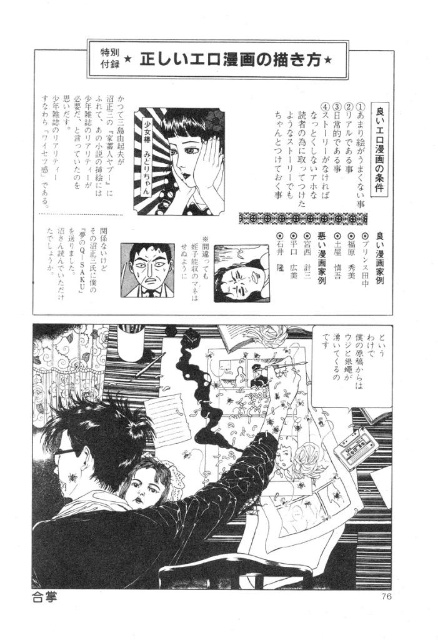
Question: Is smooth black hair at upper center positioned at the back of smooth black hair at center?

Choices:
 (A) yes
 (B) no

Answer: (B)

Question: Which of the following is the farthest from the observer?

Choices:
 (A) black glossy hair at center
 (B) matte black face at center
 (C) smooth black hair at center

Answer: (B)

Question: Is black glossy hair at center below matte black face at center?

Choices:
 (A) yes
 (B) no

Answer: (A)

Question: Which object is positioned closest to the smooth black hair at center?

Choices:
 (A) black glossy hair at center
 (B) matte black face at center
 (C) smooth black hair at upper center

Answer: (B)

Question: Does black glossy hair at center have a lesser width compared to matte black face at center?

Choices:
 (A) no
 (B) yes

Answer: (A)

Question: Which point is farther to the camera?

Choices:
 (A) black glossy hair at center
 (B) smooth black hair at center

Answer: (B)